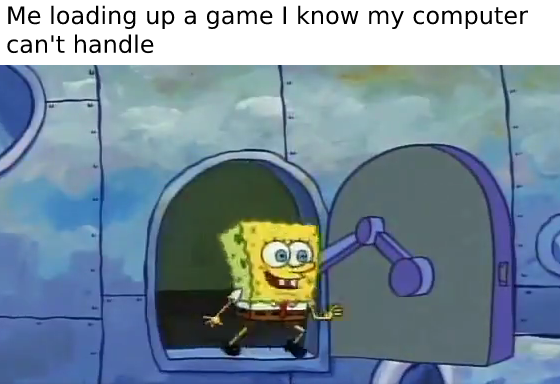
At what (x,y) coordinates should I click in order to perform the action: click on door. Please return your answer as a coordinate pair (x, y). Looking at the image, I should click on (410, 219).